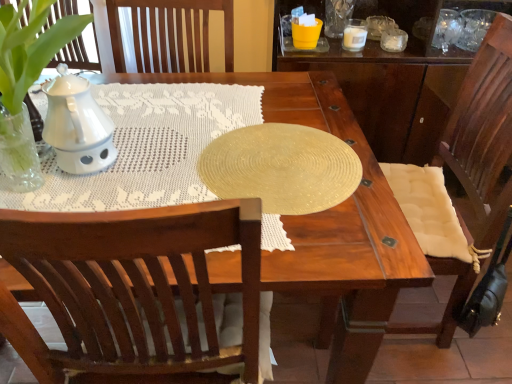
Question: Considering the relative positions of shiny gold placemat at center and white ceramic candle at upper right in the image provided, is shiny gold placemat at center to the left of white ceramic candle at upper right from the viewer's perspective?

Choices:
 (A) no
 (B) yes

Answer: (B)

Question: Is shiny gold placemat at center thinner than white ceramic candle at upper right?

Choices:
 (A) yes
 (B) no

Answer: (B)

Question: Is shiny gold placemat at center looking in the opposite direction of white ceramic candle at upper right?

Choices:
 (A) no
 (B) yes

Answer: (A)

Question: Is shiny gold placemat at center touching white ceramic candle at upper right?

Choices:
 (A) yes
 (B) no

Answer: (B)

Question: From the image's perspective, is shiny gold placemat at center above white ceramic candle at upper right?

Choices:
 (A) yes
 (B) no

Answer: (B)

Question: From the image's perspective, is shiny gold placemat at center under white ceramic candle at upper right?

Choices:
 (A) no
 (B) yes

Answer: (B)

Question: Is the position of shiny gold placemat at center less distant than that of white textured cushion at right?

Choices:
 (A) yes
 (B) no

Answer: (B)

Question: Does shiny gold placemat at center have a larger size compared to white textured cushion at right?

Choices:
 (A) yes
 (B) no

Answer: (B)

Question: Is shiny gold placemat at center taller than white textured cushion at right?

Choices:
 (A) no
 (B) yes

Answer: (A)

Question: Considering the relative positions of shiny gold placemat at center and white textured cushion at right in the image provided, is shiny gold placemat at center behind white textured cushion at right?

Choices:
 (A) yes
 (B) no

Answer: (A)

Question: Is there a large distance between shiny gold placemat at center and white textured cushion at right?

Choices:
 (A) yes
 (B) no

Answer: (B)

Question: Is shiny gold placemat at center thinner than white textured cushion at right?

Choices:
 (A) no
 (B) yes

Answer: (B)

Question: Is white textured cushion at right bigger than white ceramic candle at upper right?

Choices:
 (A) yes
 (B) no

Answer: (A)